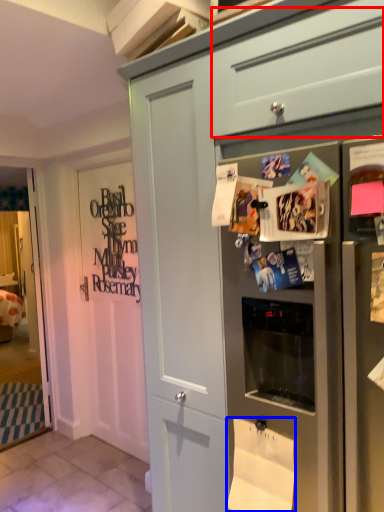
Question: Which object is further to the camera taking this photo, drawer (highlighted by a red box) or toilet paper (highlighted by a blue box)?

Choices:
 (A) drawer
 (B) toilet paper

Answer: (B)